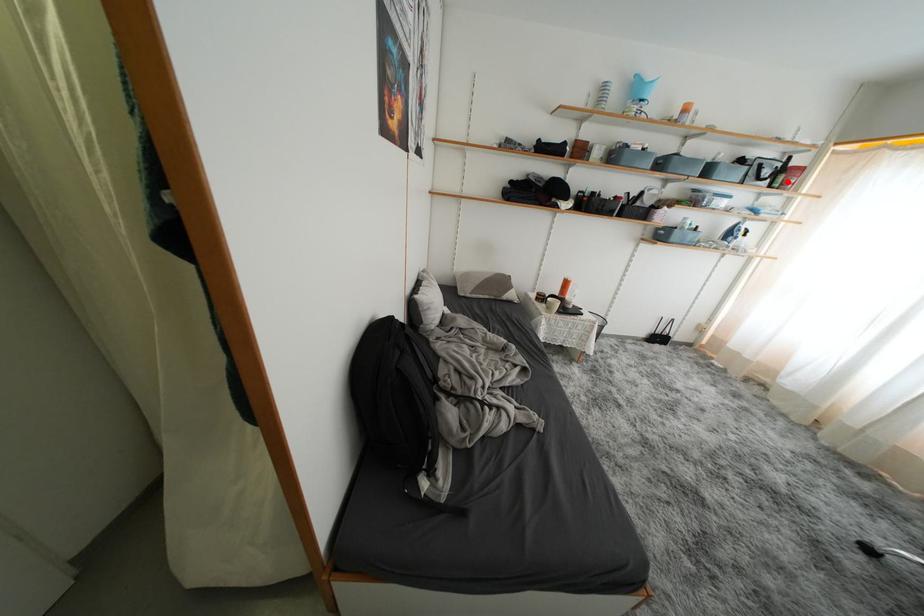
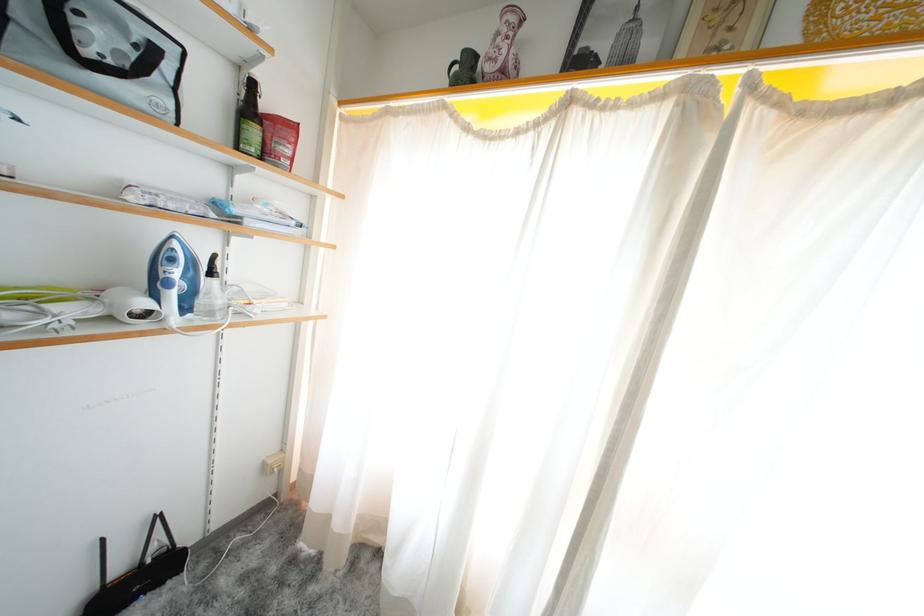
In the second image, find the point that corresponds to the highlighted location in the first image.

(261, 137)